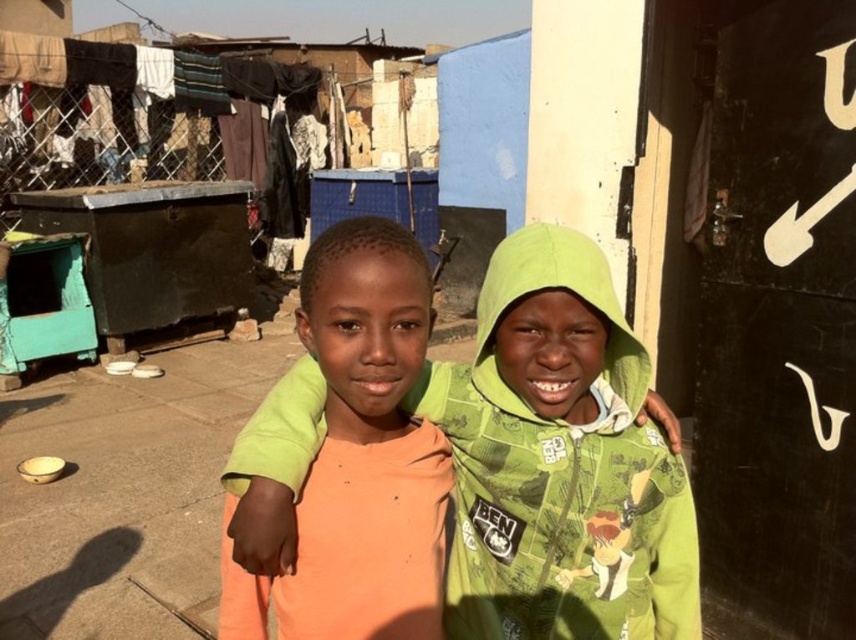
Question: Considering the relative positions of green cotton hoodie at center and orange cotton shirt at center in the image provided, where is green cotton hoodie at center located with respect to orange cotton shirt at center?

Choices:
 (A) below
 (B) above

Answer: (A)

Question: Does green cotton hoodie at center appear under orange cotton shirt at center?

Choices:
 (A) yes
 (B) no

Answer: (A)

Question: Can you confirm if green cotton hoodie at center is positioned to the right of orange cotton shirt at center?

Choices:
 (A) no
 (B) yes

Answer: (B)

Question: Among these points, which one is nearest to the camera?

Choices:
 (A) (628, 452)
 (B) (342, 435)

Answer: (B)

Question: Which point is closer to the camera?

Choices:
 (A) orange cotton shirt at center
 (B) green cotton hoodie at center

Answer: (A)